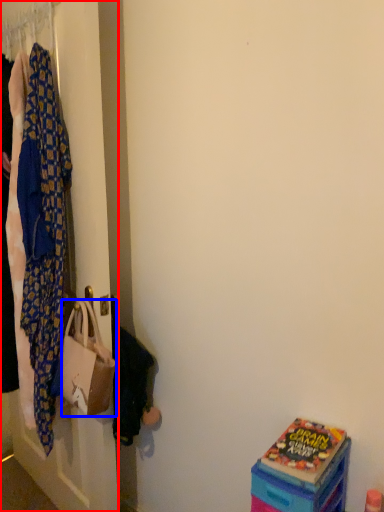
Question: Which of the following is the closest to the observer, closet (highlighted by a red box) or handbag (highlighted by a blue box)?

Choices:
 (A) closet
 (B) handbag

Answer: (A)